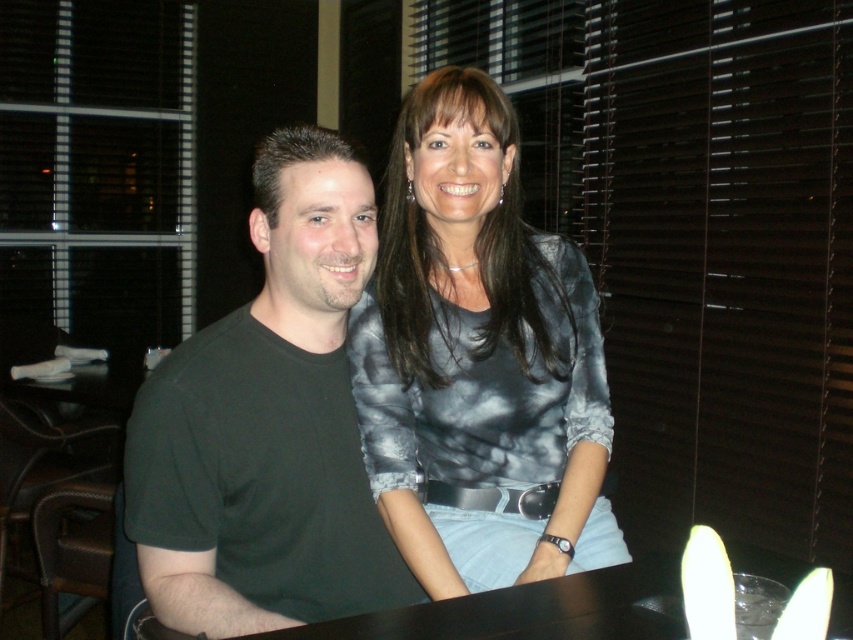
You are a photographer setting up for a group photo. You notice the metallic gray shirt at upper center and the matte gray blouse at center in the frame. Which clothing item is closer to the camera?

The metallic gray shirt at upper center is positioned over the matte gray blouse at center, meaning it is closer to the camera.